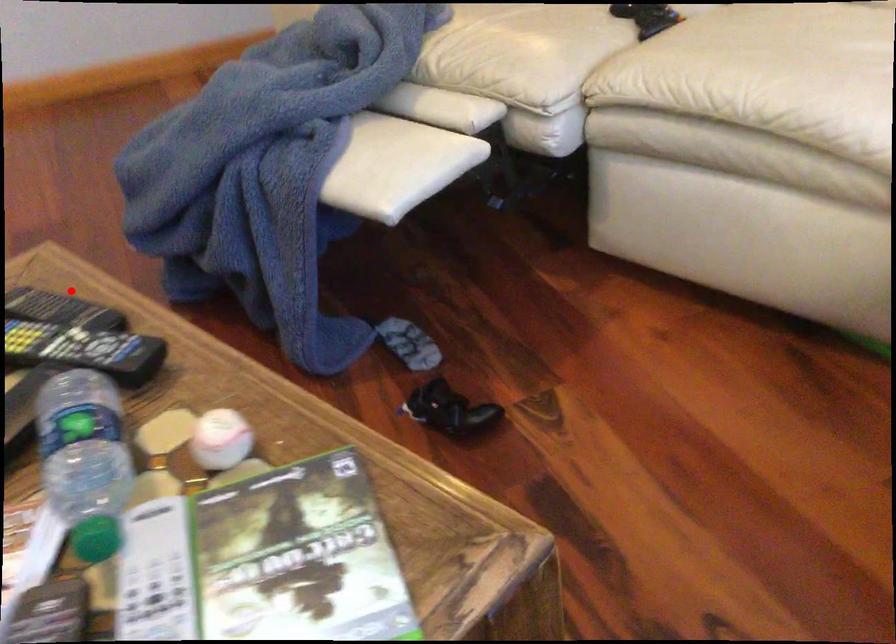
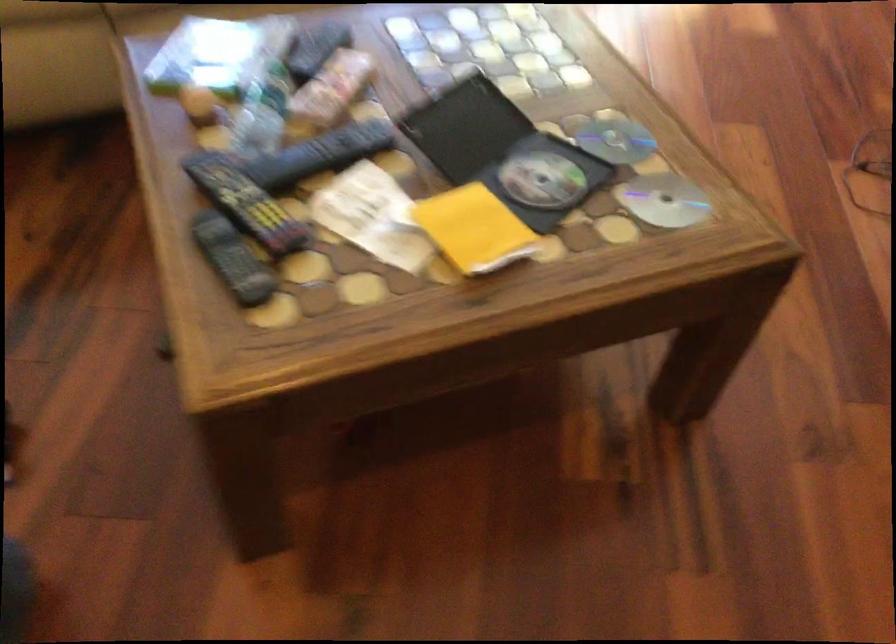
The point at the highlighted location is marked in the first image. Where is the corresponding point in the second image?

(233, 259)